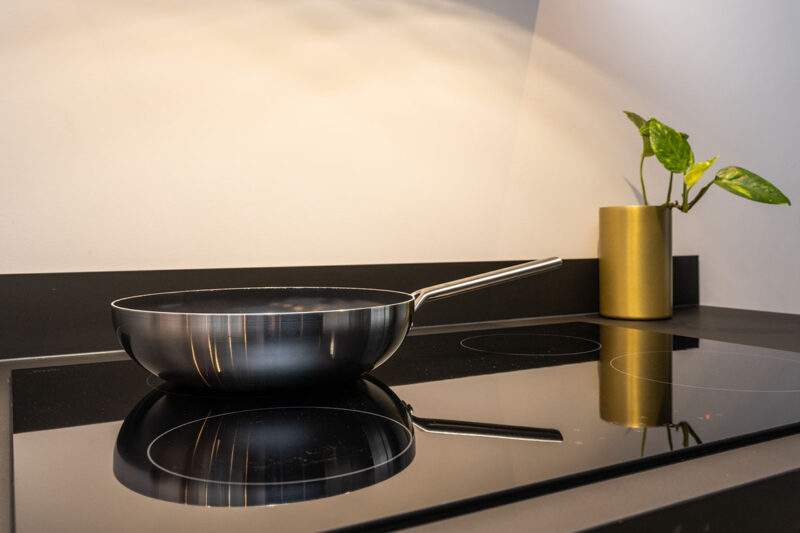
At what (x,y) coordinates should I click in order to perform the action: click on grey countertop. Please return your answer as a coordinate pair (x, y). This screenshot has height=533, width=800. Looking at the image, I should click on point(690,480).